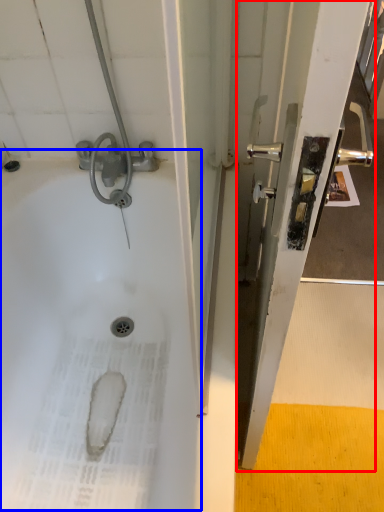
Question: Which object is closer to the camera taking this photo, screen door (highlighted by a red box) or bath (highlighted by a blue box)?

Choices:
 (A) screen door
 (B) bath

Answer: (A)